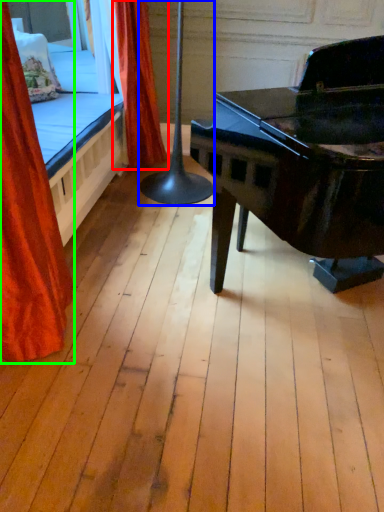
Question: Which object is positioned closest to curtain (highlighted by a red box)? Select from table lamp (highlighted by a blue box) and curtain (highlighted by a green box).

Choices:
 (A) table lamp
 (B) curtain

Answer: (A)